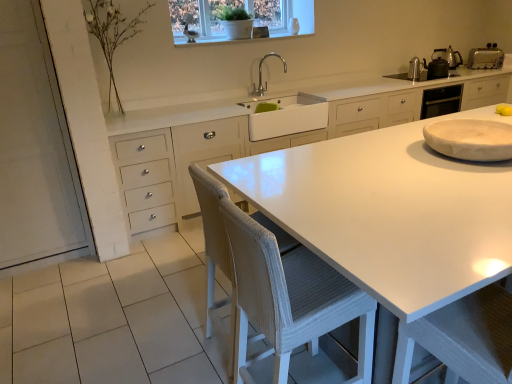
Question: Is white marble plate at right, which is the 4th appliance from top to bottom, wider or thinner than silver metallic faucet at upper center?

Choices:
 (A) thin
 (B) wide

Answer: (B)

Question: In the image, is white marble plate at right, the fourth appliance positioned from the back, on the left side or the right side of silver metallic faucet at upper center?

Choices:
 (A) left
 (B) right

Answer: (B)

Question: Estimate the real-world distances between objects in this image. Which object is farther from the yellow matte lemon at upper right?

Choices:
 (A) white glossy countertop at center
 (B) silver metallic toaster at upper right, acting as the 4th appliance starting from the left
 (C) white glossy window at upper center
 (D) metallic silver kettle at upper right, arranged as the fourth appliance when viewed from the front
 (E) metallic silver kettle at upper right, which is the 2th appliance from left to right

Answer: (C)

Question: Which of these objects is positioned closest to the white woven chair at center?

Choices:
 (A) silver metallic toaster at upper right, which is the second appliance from top to bottom
 (B) yellow matte lemon at upper right
 (C) metallic silver kettle at upper right, which appears as the 1th appliance when viewed from the back
 (D) white glossy window at upper center
 (E) silver metallic faucet at upper center

Answer: (B)